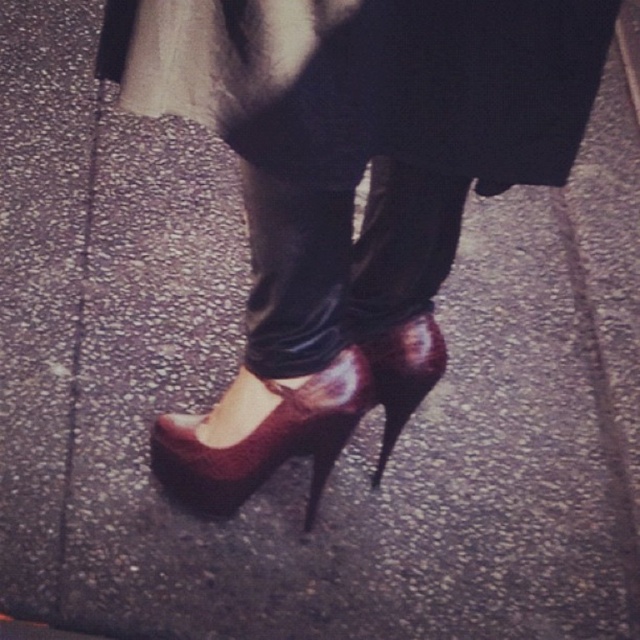
Which is more to the left, shiny burgundy leather high-heeled shoe at center or shiny burgundy high-heeled shoe at center?

shiny burgundy leather high-heeled shoe at center is more to the left.

Between shiny burgundy leather high-heeled shoe at center and shiny burgundy high-heeled shoe at center, which one has less height?

Standing shorter between the two is shiny burgundy high-heeled shoe at center.

Does point (221, 500) come farther from viewer compared to point (406, 384)?

Yes.

This screenshot has width=640, height=640. Identify the location of shiny burgundy leather high-heeled shoe at center. (266, 440).

Does point (353, 397) come farther from viewer compared to point (636, 22)?

No, (353, 397) is closer to viewer.

This screenshot has width=640, height=640. What are the coordinates of `shiny burgundy leather high-heeled shoe at center` in the screenshot? It's located at point(266,440).

Which is in front, point (298, 422) or point (636, 83)?

Point (298, 422) is more forward.

At what (x,y) coordinates should I click in order to perform the action: click on shiny burgundy leather high-heeled shoe at center. Please return your answer as a coordinate pair (x, y). The width and height of the screenshot is (640, 640). Looking at the image, I should click on (266, 440).

Can you confirm if shiny burgundy high-heeled shoe at center is positioned below metallic silver curb at lower right?

Correct, shiny burgundy high-heeled shoe at center is located below metallic silver curb at lower right.

Is shiny burgundy high-heeled shoe at center positioned at the back of metallic silver curb at lower right?

No, it is in front of metallic silver curb at lower right.

What do you see at coordinates (403, 374) in the screenshot? The width and height of the screenshot is (640, 640). I see `shiny burgundy high-heeled shoe at center` at bounding box center [403, 374].

Locate an element on the screen. This screenshot has height=640, width=640. shiny burgundy high-heeled shoe at center is located at coordinates (403, 374).